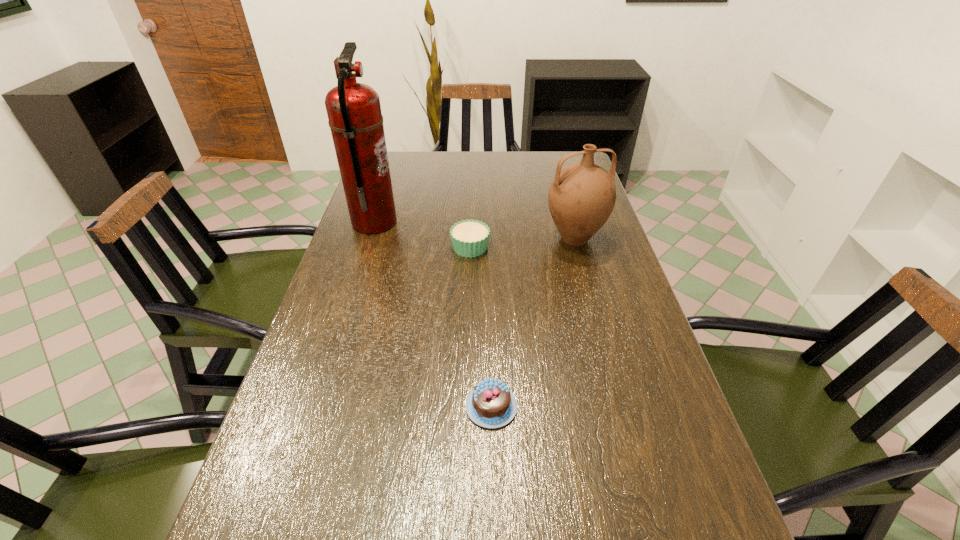
Find the location of a particular element. The height and width of the screenshot is (540, 960). object at the left edge is located at coordinates (354, 112).

The height and width of the screenshot is (540, 960). What are the coordinates of `object located at the right edge` in the screenshot? It's located at (581, 198).

The width and height of the screenshot is (960, 540). In order to click on vacant space at the far edge of the desktop in this screenshot , I will do `click(448, 158)`.

In the image, there is a desktop. Identify the location of vacant space at the left edge. (341, 292).

Locate an element on the screen. vacant space at the right edge of the desktop is located at coordinates (614, 402).

The height and width of the screenshot is (540, 960). Find the location of `free spot between the cupcake and the fire extinguisher`. free spot between the cupcake and the fire extinguisher is located at coordinates (422, 235).

This screenshot has width=960, height=540. Find the location of `unoccupied position between the cupcake and the leftmost object`. unoccupied position between the cupcake and the leftmost object is located at coordinates (422, 235).

I want to click on vacant space that's between the cupcake and the nearest object, so click(481, 327).

Where is `unoccupied position between the leftmost object and the cupcake`? unoccupied position between the leftmost object and the cupcake is located at coordinates (422, 235).

Identify the location of free spot between the third shortest object and the cupcake. (522, 243).